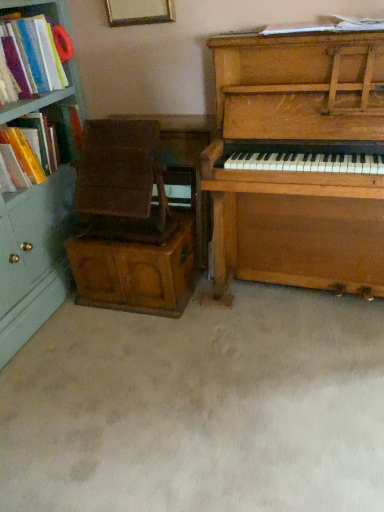
Measure the distance between wooden piano at right and camera.

A distance of 4.53 feet exists between wooden piano at right and camera.

Where is `wooden armchair at left, which is counted as the 2th armchair, starting from the bottom`? wooden armchair at left, which is counted as the 2th armchair, starting from the bottom is located at coordinates (121, 183).

Identify the location of wooden picture frame at upper center. The image size is (384, 512). (139, 12).

In order to face matte plastic books at left, the first book in the left-to-right sequence, should I rotate leftwards or rightwards?

A 25.198 degree turn to the left will do.

Locate an element on the screen. The width and height of the screenshot is (384, 512). matte plastic books at left, marked as the third book in a right-to-left arrangement is located at coordinates (32, 56).

Image resolution: width=384 pixels, height=512 pixels. Find the location of `wooden piano at right`. wooden piano at right is located at coordinates (298, 162).

In terms of size, does wooden picture frame at upper center appear bigger or smaller than white paper at upper center, positioned as the 3th book in left-to-right order?

In the image, wooden picture frame at upper center appears to be larger than white paper at upper center, positioned as the 3th book in left-to-right order.

From a real-world perspective, which object stands above the other?

In real-world perspective, wooden picture frame at upper center is above.

Are wooden picture frame at upper center and white paper at upper center, marked as the 1th book in a right-to-left arrangement, beside each other?

wooden picture frame at upper center and white paper at upper center, marked as the 1th book in a right-to-left arrangement, are clearly separated.

Measure the distance from wooden picture frame at upper center to white paper at upper center, marked as the 1th book in a right-to-left arrangement.

wooden picture frame at upper center is 60.88 centimeters from white paper at upper center, marked as the 1th book in a right-to-left arrangement.

From a real-world perspective, is wooden piano at right positioned over white paper at upper center, positioned as the 3th book in left-to-right order, based on gravity?

No.

From the image's perspective, between wooden piano at right and white paper at upper center, positioned as the 3th book in left-to-right order, which one is located above?

From the image's view, white paper at upper center, positioned as the 3th book in left-to-right order, is above.

Is wooden piano at right in front of white paper at upper center, marked as the 1th book in a right-to-left arrangement?

Yes.

Considering the relative sizes of matte plastic books at left, the first book in the left-to-right sequence, and wooden armchair at center-left, acting as the 1th armchair starting from the bottom, in the image provided, is matte plastic books at left, the first book in the left-to-right sequence, wider than wooden armchair at center-left, acting as the 1th armchair starting from the bottom,?

Incorrect, the width of matte plastic books at left, the first book in the left-to-right sequence, does not surpass that of wooden armchair at center-left, acting as the 1th armchair starting from the bottom.

From a real-world perspective, is matte plastic books at left, the first book in the left-to-right sequence, physically below wooden armchair at center-left, acting as the 1th armchair starting from the bottom?

No.

Would you consider matte plastic books at left, the first book in the left-to-right sequence, to be distant from wooden armchair at center-left, which ranks as the 2th armchair in top-to-bottom order?

matte plastic books at left, the first book in the left-to-right sequence, is actually quite close to wooden armchair at center-left, which ranks as the 2th armchair in top-to-bottom order.

Relative to wooden armchair at center-left, which ranks as the 2th armchair in top-to-bottom order, is matte plastic books at left, the first book in the left-to-right sequence, in front or behind?

matte plastic books at left, the first book in the left-to-right sequence, is in front of wooden armchair at center-left, which ranks as the 2th armchair in top-to-bottom order.

From the image's perspective, is white paper at upper center, positioned as the 3th book in left-to-right order, on top of wooden armchair at left, acting as the first armchair starting from the top?

Yes.

Between white paper at upper center, positioned as the 3th book in left-to-right order, and wooden armchair at left, which is counted as the 2th armchair, starting from the bottom, which one appears on the left side from the viewer's perspective?

Positioned to the left is wooden armchair at left, which is counted as the 2th armchair, starting from the bottom.

Is point (273, 28) positioned after point (146, 223)?

No.

Is matte plastic books at left, marked as the third book in a right-to-left arrangement, to the right of matte plastic book at left, the second book viewed from the left, from the viewer's perspective?

Incorrect, matte plastic books at left, marked as the third book in a right-to-left arrangement, is not on the right side of matte plastic book at left, the second book viewed from the left.

Considering the relative sizes of matte plastic books at left, marked as the third book in a right-to-left arrangement, and matte plastic book at left, the second book when ordered from right to left, in the image provided, is matte plastic books at left, marked as the third book in a right-to-left arrangement, smaller than matte plastic book at left, the second book when ordered from right to left,?

Yes, matte plastic books at left, marked as the third book in a right-to-left arrangement, is smaller than matte plastic book at left, the second book when ordered from right to left.

How many degrees apart are the facing directions of matte plastic books at left, the first book in the left-to-right sequence, and matte plastic book at left, the second book viewed from the left?

matte plastic books at left, the first book in the left-to-right sequence, and matte plastic book at left, the second book viewed from the left, are facing 1.14 degrees away from each other.

Who is more distant, matte plastic books at left, marked as the third book in a right-to-left arrangement, or matte plastic book at left, the second book viewed from the left?

matte plastic book at left, the second book viewed from the left, is further away from the camera.

Considering the relative sizes of white paper at upper center, marked as the 1th book in a right-to-left arrangement, and matte plastic books at left, marked as the third book in a right-to-left arrangement, in the image provided, is white paper at upper center, marked as the 1th book in a right-to-left arrangement, thinner than matte plastic books at left, marked as the third book in a right-to-left arrangement,?

Yes.

Consider the image. Which is farther, (342, 19) or (45, 27)?

Point (45, 27)

Is white paper at upper center, positioned as the 3th book in left-to-right order, with matte plastic books at left, the first book in the left-to-right sequence?

They are not placed beside each other.

Is wooden armchair at center-left, acting as the 1th armchair starting from the bottom, next to white paper at upper center, positioned as the 3th book in left-to-right order, and touching it?

No, wooden armchair at center-left, acting as the 1th armchair starting from the bottom, is not beside white paper at upper center, positioned as the 3th book in left-to-right order.

From the image's perspective, is wooden armchair at center-left, acting as the 1th armchair starting from the bottom, located above white paper at upper center, positioned as the 3th book in left-to-right order?

No, from the image's perspective, wooden armchair at center-left, acting as the 1th armchair starting from the bottom, is not on top of white paper at upper center, positioned as the 3th book in left-to-right order.

Is wooden armchair at center-left, which ranks as the 2th armchair in top-to-bottom order, positioned with its back to white paper at upper center, marked as the 1th book in a right-to-left arrangement?

wooden armchair at center-left, which ranks as the 2th armchair in top-to-bottom order, does not have its back to white paper at upper center, marked as the 1th book in a right-to-left arrangement.

Considering the sizes of objects wooden armchair at center-left, which ranks as the 2th armchair in top-to-bottom order, and white paper at upper center, marked as the 1th book in a right-to-left arrangement, in the image provided, who is wider, wooden armchair at center-left, which ranks as the 2th armchair in top-to-bottom order, or white paper at upper center, marked as the 1th book in a right-to-left arrangement,?

Wider between the two is wooden armchair at center-left, which ranks as the 2th armchair in top-to-bottom order.

Where is `picture frame that appears above the white paper at upper center, positioned as the 3th book in left-to-right order (from the image's perspective)`? Image resolution: width=384 pixels, height=512 pixels. picture frame that appears above the white paper at upper center, positioned as the 3th book in left-to-right order (from the image's perspective) is located at coordinates (139, 12).

Locate an element on the screen. piano below the white paper at upper center, marked as the 1th book in a right-to-left arrangement (from the image's perspective) is located at coordinates (298, 162).

Estimate the real-world distances between objects in this image. Which object is closer to wooden piano at right, matte plastic books at left, marked as the third book in a right-to-left arrangement, or wooden picture frame at upper center?

wooden picture frame at upper center is positioned closer to the anchor wooden piano at right.

From the picture: Looking at the image, which one is located further to matte plastic book at left, the second book when ordered from right to left, wooden picture frame at upper center or wooden armchair at center-left, acting as the 1th armchair starting from the bottom?

wooden picture frame at upper center is positioned further to the anchor matte plastic book at left, the second book when ordered from right to left.

From the image, which object appears to be farther from wooden picture frame at upper center, wooden piano at right or wooden armchair at left, which is counted as the 2th armchair, starting from the bottom?

wooden piano at right.

Based on their spatial positions, is white paper at upper center, marked as the 1th book in a right-to-left arrangement, or wooden armchair at left, which is counted as the 2th armchair, starting from the bottom, closer to matte plastic book at left, the second book when ordered from right to left?

Among the two, wooden armchair at left, which is counted as the 2th armchair, starting from the bottom, is located nearer to matte plastic book at left, the second book when ordered from right to left.

Which object lies nearer to the anchor point white paper at upper center, marked as the 1th book in a right-to-left arrangement, matte plastic books at left, marked as the third book in a right-to-left arrangement, or wooden picture frame at upper center?

Among the two, wooden picture frame at upper center is located nearer to white paper at upper center, marked as the 1th book in a right-to-left arrangement.

Based on their spatial positions, is matte plastic books at left, the first book in the left-to-right sequence, or wooden armchair at center-left, acting as the 1th armchair starting from the bottom, closer to wooden piano at right?

wooden armchair at center-left, acting as the 1th armchair starting from the bottom.

When comparing their distances from white paper at upper center, positioned as the 3th book in left-to-right order, does matte plastic book at left, the second book when ordered from right to left, or matte plastic books at left, marked as the third book in a right-to-left arrangement, seem further?

The object further to white paper at upper center, positioned as the 3th book in left-to-right order, is matte plastic book at left, the second book when ordered from right to left.

From the image, which object appears to be farther from matte plastic book at left, the second book viewed from the left, white paper at upper center, positioned as the 3th book in left-to-right order, or wooden picture frame at upper center?

white paper at upper center, positioned as the 3th book in left-to-right order, is further to matte plastic book at left, the second book viewed from the left.

You are a GUI agent. You are given a task and a screenshot of the screen. Output one action in this format:
    pyautogui.click(x=<x>, y=<y>)
    Task: Click on the armchair between matte plastic book at left, the second book when ordered from right to left, and wooden armchair at center-left, which ranks as the 2th armchair in top-to-bottom order, in the horizontal direction
    This screenshot has height=512, width=384.
    Given the screenshot: What is the action you would take?
    pyautogui.click(x=121, y=183)

Where is `armchair between wooden picture frame at upper center and wooden piano at right from top to bottom`? armchair between wooden picture frame at upper center and wooden piano at right from top to bottom is located at coordinates (121, 183).

Locate an element on the screen. book located between wooden armchair at center-left, which ranks as the 2th armchair in top-to-bottom order, and wooden piano at right in the left-right direction is located at coordinates (326, 26).

Locate an element on the screen. picture frame between matte plastic book at left, the second book viewed from the left, and white paper at upper center, positioned as the 3th book in left-to-right order, from left to right is located at coordinates (139, 12).